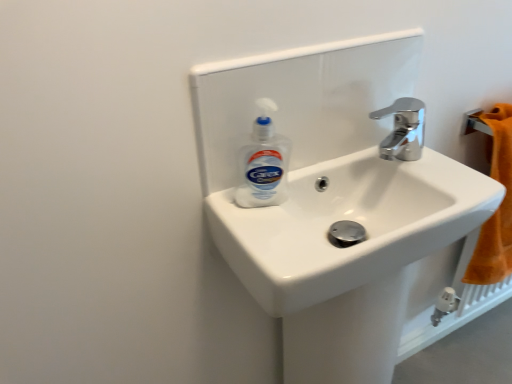
Describe the element at coordinates (403, 130) in the screenshot. The width and height of the screenshot is (512, 384). I see `chrome metallic faucet at upper right` at that location.

Identify the location of chrome metallic faucet at upper right. (403, 130).

Is white glossy sink at center wider or thinner than white plastic bottle at center?

In the image, white glossy sink at center appears to be wider than white plastic bottle at center.

From a real-world perspective, who is located lower, white glossy sink at center or white plastic bottle at center?

In real-world perspective, white glossy sink at center is lower.

Does white glossy sink at center touch white plastic bottle at center?

No, white glossy sink at center is not next to white plastic bottle at center.

Considering the sizes of white plastic bottle at center and white glossy sink at center in the image, is white plastic bottle at center wider or thinner than white glossy sink at center?

Considering their sizes, white plastic bottle at center looks slimmer than white glossy sink at center.

Locate an element on the screen. This screenshot has height=384, width=512. sink below the white plastic bottle at center (from the image's perspective) is located at coordinates (348, 219).

Does white plastic bottle at center have a larger size compared to white glossy sink at center?

No, white plastic bottle at center is not bigger than white glossy sink at center.

Is white plastic bottle at center in front of white glossy sink at center?

No, it is not.

From the image's perspective, who appears lower, chrome metallic faucet at upper right or white plastic bottle at center?

From the image's view, white plastic bottle at center is below.

Does chrome metallic faucet at upper right touch white plastic bottle at center?

No, chrome metallic faucet at upper right is not touching white plastic bottle at center.

Is chrome metallic faucet at upper right to the left of white plastic bottle at center from the viewer's perspective?

No, chrome metallic faucet at upper right is not to the left of white plastic bottle at center.

Looking at their sizes, would you say chrome metallic faucet at upper right is wider or thinner than white plastic bottle at center?

chrome metallic faucet at upper right is wider than white plastic bottle at center.

From their relative heights in the image, would you say chrome metallic faucet at upper right is taller or shorter than white glossy sink at center?

In the image, chrome metallic faucet at upper right appears to be shorter than white glossy sink at center.

How many degrees apart are the facing directions of chrome metallic faucet at upper right and white glossy sink at center?

There is a 0.00813-degree angle between the facing directions of chrome metallic faucet at upper right and white glossy sink at center.

Considering the relative sizes of chrome metallic faucet at upper right and white glossy sink at center in the image provided, is chrome metallic faucet at upper right wider than white glossy sink at center?

No, chrome metallic faucet at upper right is not wider than white glossy sink at center.

Does white glossy sink at center turn towards chrome metallic faucet at upper right?

No, white glossy sink at center is not oriented towards chrome metallic faucet at upper right.

Is chrome metallic faucet at upper right located within white glossy sink at center?

No, chrome metallic faucet at upper right is located outside of white glossy sink at center.

What's the angular difference between white glossy sink at center and chrome metallic faucet at upper right's facing directions?

They differ by 0.00813 degrees in their facing directions.

Which is further, (290, 288) or (408, 113)?

The point (408, 113) is farther.

Does white plastic bottle at center have a larger size compared to chrome metallic faucet at upper right?

Incorrect, white plastic bottle at center is not larger than chrome metallic faucet at upper right.

Does white plastic bottle at center touch chrome metallic faucet at upper right?

There is a gap between white plastic bottle at center and chrome metallic faucet at upper right.

Which object is positioned more to the right, white plastic bottle at center or chrome metallic faucet at upper right?

chrome metallic faucet at upper right is more to the right.

Is point (268, 151) in front of point (419, 116)?

That is True.

The height and width of the screenshot is (384, 512). What are the coordinates of `sink on the right of the white plastic bottle at center` in the screenshot? It's located at (348, 219).

At what (x,y) coordinates should I click in order to perform the action: click on cleaning product on the left of white glossy sink at center. Please return your answer as a coordinate pair (x, y). Looking at the image, I should click on (263, 163).

When comparing their distances from white glossy sink at center, does white plastic bottle at center or chrome metallic faucet at upper right seem further?

Among the two, chrome metallic faucet at upper right is located further to white glossy sink at center.

Which object lies further to the anchor point white glossy sink at center, chrome metallic faucet at upper right or white plastic bottle at center?

chrome metallic faucet at upper right is further to white glossy sink at center.

Consider the image. Considering their positions, is white glossy sink at center positioned further to chrome metallic faucet at upper right than white plastic bottle at center?

white plastic bottle at center is further to chrome metallic faucet at upper right.

Considering their positions, is chrome metallic faucet at upper right positioned closer to white plastic bottle at center than white glossy sink at center?

white glossy sink at center is closer to white plastic bottle at center.

Based on the photo, from the image, which object appears to be nearer to chrome metallic faucet at upper right, white plastic bottle at center or white glossy sink at center?

white glossy sink at center is closer to chrome metallic faucet at upper right.

Looking at the image, which one is located further to white plastic bottle at center, white glossy sink at center or chrome metallic faucet at upper right?

A: chrome metallic faucet at upper right is positioned further to the anchor white plastic bottle at center.

Find the location of a particular element. This screenshot has width=512, height=384. sink between white plastic bottle at center and chrome metallic faucet at upper right from left to right is located at coordinates (348, 219).